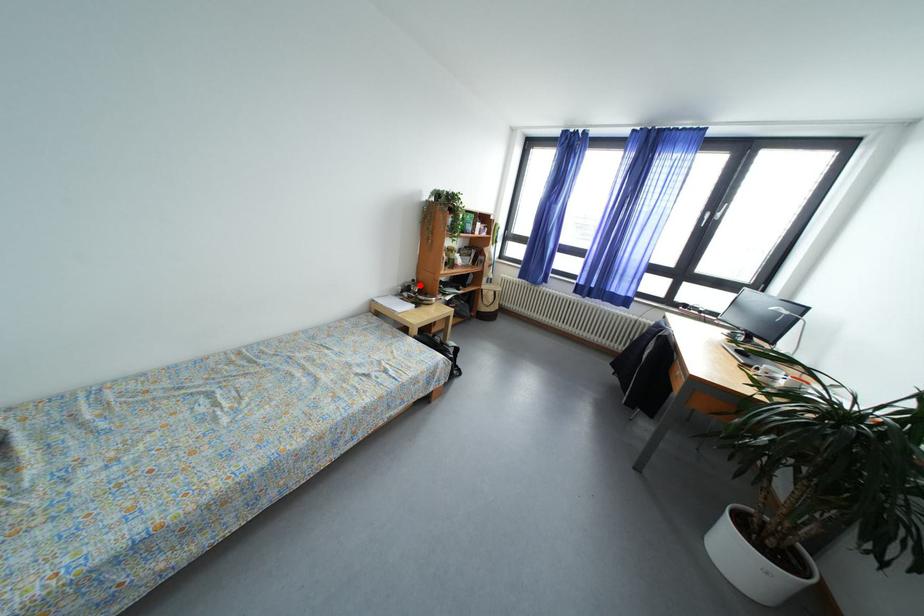
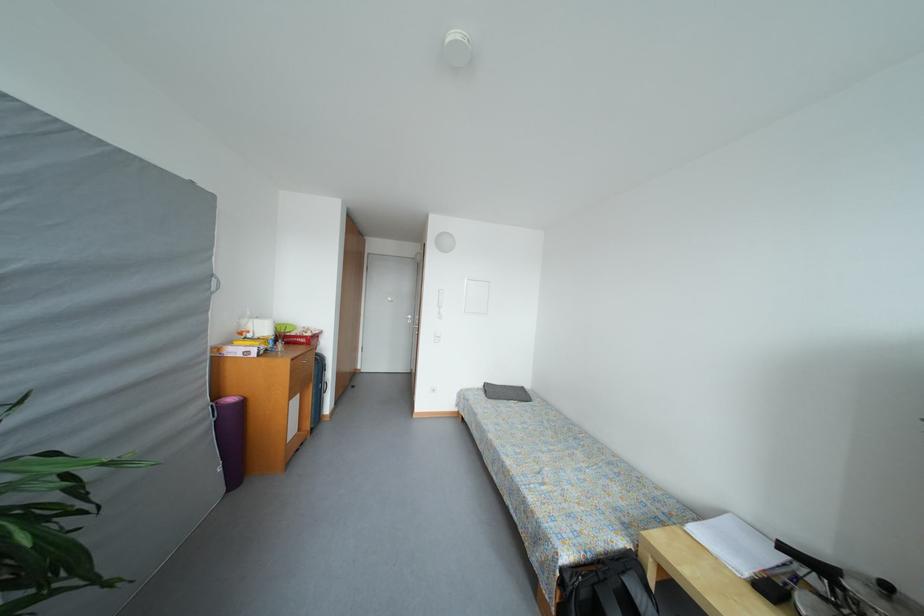
Question: I am providing you with two images of the same scene from different viewpoints. Image1 has a red point marked. In image2, the corresponding 3D location appears at what relative position? Reply with the corresponding letter.

Choices:
 (A) Closer
 (B) Farther

Answer: (B)